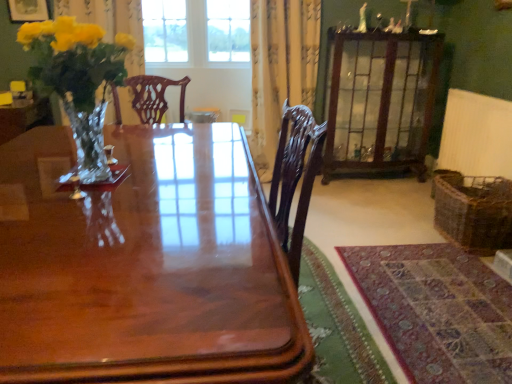
The image size is (512, 384). In order to click on free location to the left of shiny glass vase with yellow flowers at left in this screenshot , I will do `click(25, 170)`.